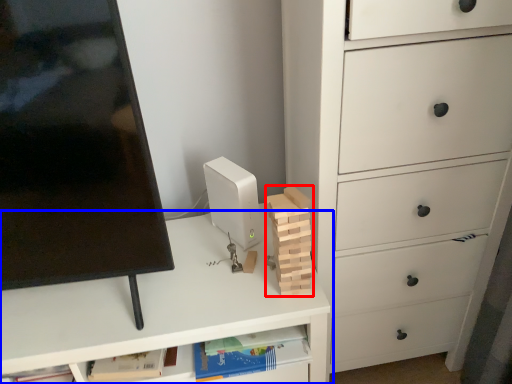
Question: Among these objects, which one is farthest to the camera, block (highlighted by a red box) or desk (highlighted by a blue box)?

Choices:
 (A) block
 (B) desk

Answer: (B)